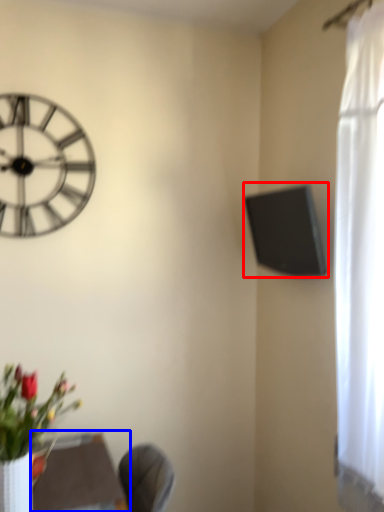
Question: Among these objects, which one is farthest to the camera, window screen (highlighted by a red box) or round table (highlighted by a blue box)?

Choices:
 (A) window screen
 (B) round table

Answer: (A)